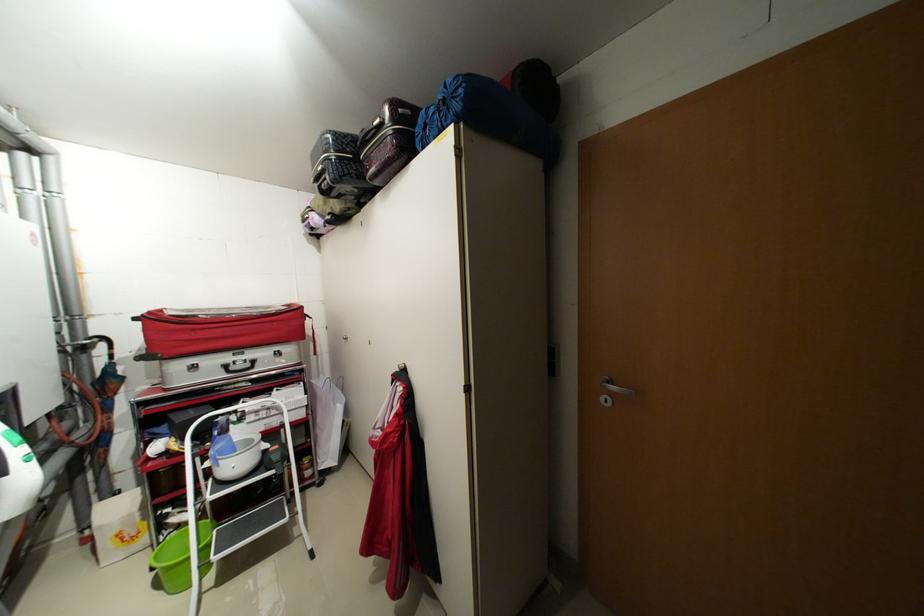
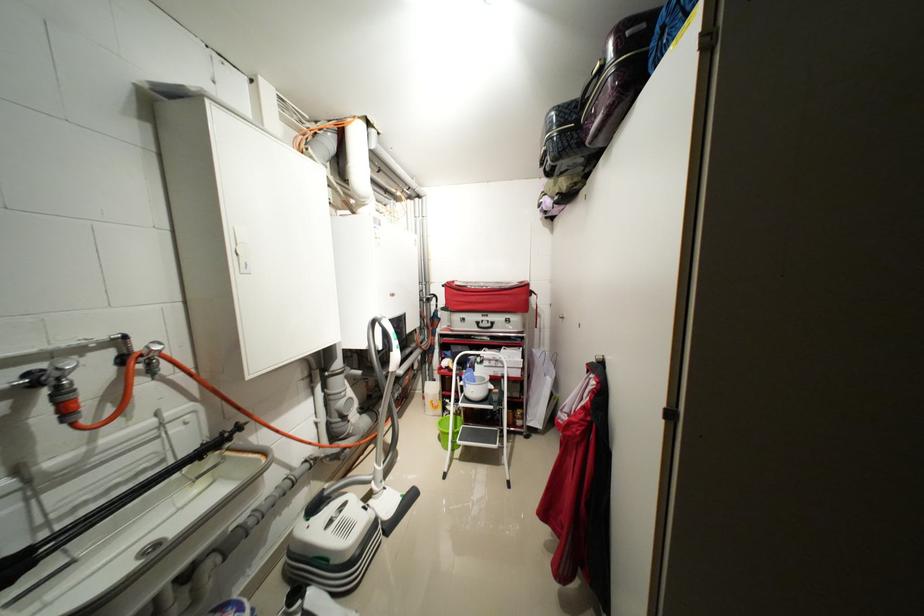
Where in the second image is the point corresponding to point (157, 314) from the first image?

(455, 284)